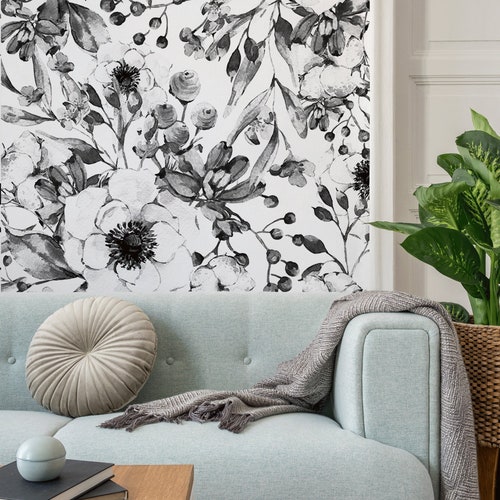
Where is `book`? The image size is (500, 500). book is located at coordinates (83, 480), (99, 488).